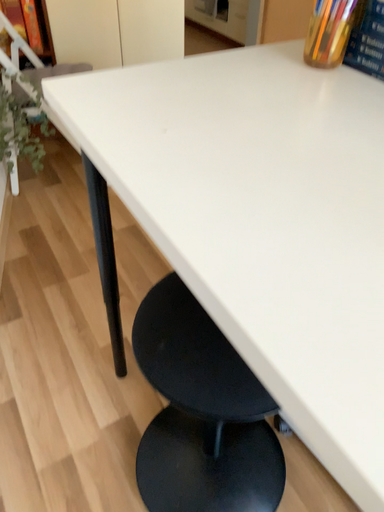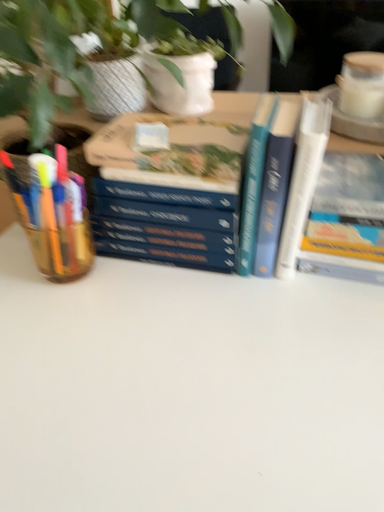
Question: Which way did the camera rotate in the video?

Choices:
 (A) rotated right
 (B) rotated left

Answer: (A)